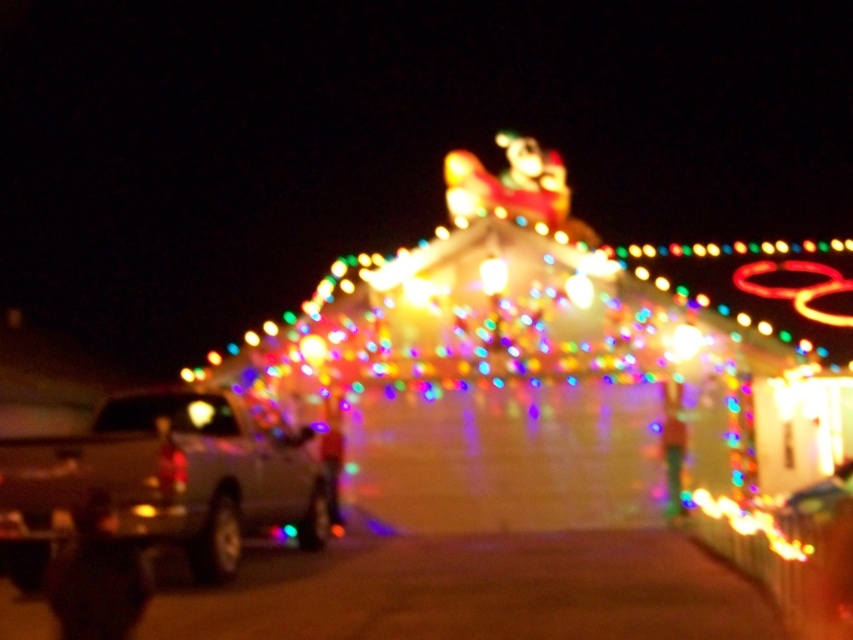
I want to click on metallic silver truck at left, so click(165, 480).

Is point (199, 458) more distant than point (802, 500)?

Yes, it is.

Who is more forward, (x=135, y=433) or (x=844, y=484)?

Point (x=135, y=433) is in front.

What are the coordinates of `metallic silver truck at left` in the screenshot? It's located at (165, 480).